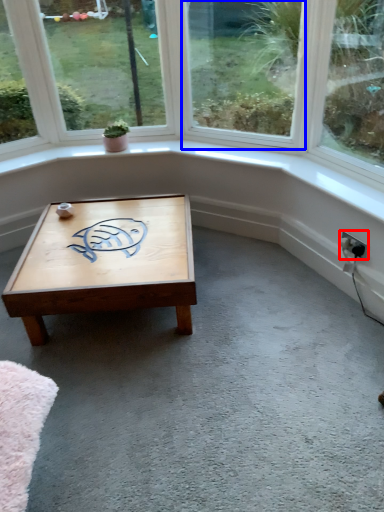
Question: Which of the following is the farthest to the observer, electric outlet (highlighted by a red box) or window (highlighted by a blue box)?

Choices:
 (A) electric outlet
 (B) window

Answer: (A)